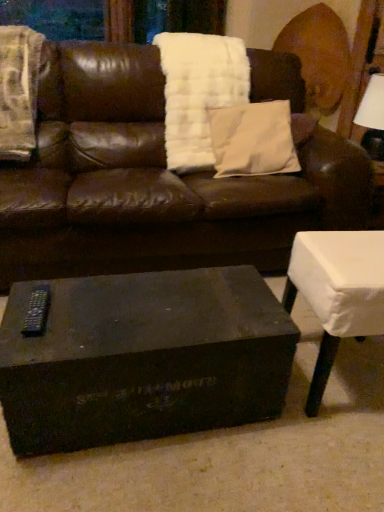
Question: Should I look upward or downward to see matte black coffee table at center?

Choices:
 (A) up
 (B) down

Answer: (B)

Question: Is white soft pillow at center oriented towards white fuzzy blanket at left, marked as the 1th blanket in a left-to-right arrangement?

Choices:
 (A) no
 (B) yes

Answer: (A)

Question: Considering the relative sizes of white soft pillow at center and white fuzzy blanket at left, the 2th blanket positioned from the right, in the image provided, is white soft pillow at center taller than white fuzzy blanket at left, the 2th blanket positioned from the right,?

Choices:
 (A) yes
 (B) no

Answer: (B)

Question: Is white soft pillow at center facing away from white fuzzy blanket at left, marked as the 1th blanket in a left-to-right arrangement?

Choices:
 (A) yes
 (B) no

Answer: (B)

Question: Would you say white soft pillow at center is outside white fuzzy blanket at left, marked as the 1th blanket in a left-to-right arrangement?

Choices:
 (A) no
 (B) yes

Answer: (B)

Question: Is the depth of white soft pillow at center less than that of white fuzzy blanket at left, marked as the 1th blanket in a left-to-right arrangement?

Choices:
 (A) no
 (B) yes

Answer: (A)

Question: Would you consider white soft pillow at center to be distant from white fuzzy blanket at left, marked as the 1th blanket in a left-to-right arrangement?

Choices:
 (A) yes
 (B) no

Answer: (B)

Question: Is white fluffy blanket at upper center, the 2th blanket positioned from the left, not inside white soft pillow at center?

Choices:
 (A) yes
 (B) no

Answer: (A)

Question: Is the depth of white fluffy blanket at upper center, the first blanket in the right-to-left sequence, greater than that of white soft pillow at center?

Choices:
 (A) no
 (B) yes

Answer: (B)

Question: Is white fluffy blanket at upper center, the 2th blanket positioned from the left, facing towards white soft pillow at center?

Choices:
 (A) yes
 (B) no

Answer: (A)

Question: From the image's perspective, is white fluffy blanket at upper center, the first blanket in the right-to-left sequence, below white soft pillow at center?

Choices:
 (A) no
 (B) yes

Answer: (A)

Question: Does white fluffy blanket at upper center, the 2th blanket positioned from the left, lie in front of white soft pillow at center?

Choices:
 (A) no
 (B) yes

Answer: (A)

Question: Can you confirm if white fluffy blanket at upper center, the first blanket in the right-to-left sequence, is positioned to the left of white soft pillow at center?

Choices:
 (A) yes
 (B) no

Answer: (A)

Question: Does white cloth-covered table at lower right have a greater width compared to black plastic remote at lower left?

Choices:
 (A) no
 (B) yes

Answer: (B)